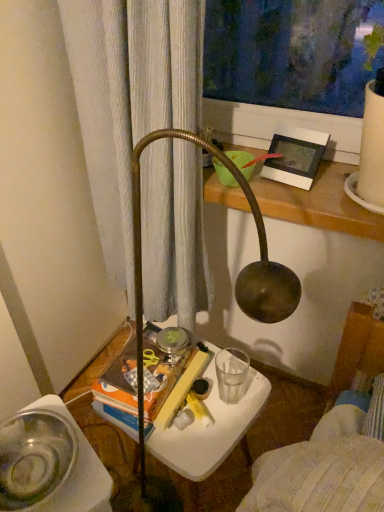
Identify the location of free point to the left of clear glass water at lower center. The width and height of the screenshot is (384, 512). (208, 380).